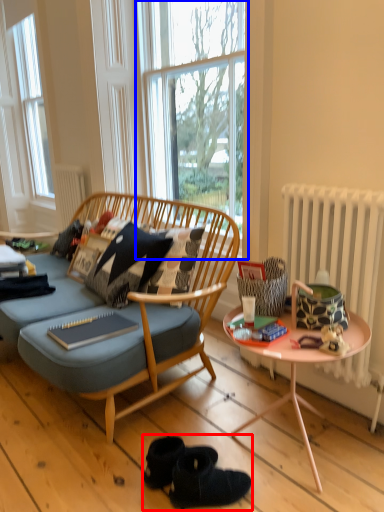
Question: Which of the following is the closest to the observer, footwear (highlighted by a red box) or window (highlighted by a blue box)?

Choices:
 (A) footwear
 (B) window

Answer: (A)